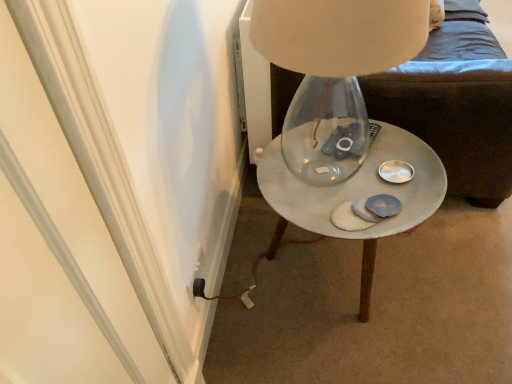
Measure the distance between point (198, 277) and camera.

They are 1.21 meters apart.

Locate an element on the screen. The height and width of the screenshot is (384, 512). black plastic outlet at lower left is located at coordinates (198, 275).

In terms of height, does white marble side table at center look taller or shorter compared to black plastic outlet at lower left?

In the image, white marble side table at center appears to be taller than black plastic outlet at lower left.

What's the angular difference between white marble side table at center and black plastic outlet at lower left's facing directions?

The angle between the facing direction of white marble side table at center and the facing direction of black plastic outlet at lower left is 1.28 degrees.

Looking at this image, considering the sizes of objects white marble side table at center and black plastic outlet at lower left in the image provided, who is thinner, white marble side table at center or black plastic outlet at lower left?

black plastic outlet at lower left.

From a real-world perspective, who is located higher, white marble side table at center or black plastic outlet at lower left?

From a 3D spatial view, black plastic outlet at lower left is above.

Which of these two, black plastic outlet at lower left or white marble side table at center, is wider?

white marble side table at center is wider.

Who is bigger, black plastic outlet at lower left or white marble side table at center?

white marble side table at center.

Does black plastic outlet at lower left turn towards white marble side table at center?

No.

From their relative heights in the image, would you say white marble side table at center is taller or shorter than black plastic outlet at lower left?

white marble side table at center is taller than black plastic outlet at lower left.

Locate an element on the screen. The width and height of the screenshot is (512, 384). furniture that appears above the black plastic outlet at lower left (from the image's perspective) is located at coordinates (453, 123).

How much distance is there between white marble side table at center and black plastic outlet at lower left?

A distance of 37.79 inches exists between white marble side table at center and black plastic outlet at lower left.

Is white marble side table at center directly adjacent to white marble side table at center?

white marble side table at center is not next to white marble side table at center, and they're not touching.

Is point (365, 97) farther from camera compared to point (304, 190)?

Yes, point (365, 97) is behind point (304, 190).

Locate an element on the screen. This screenshot has height=384, width=512. table located underneath the white marble side table at center (from a real-world perspective) is located at coordinates (356, 196).

Is white marble side table at center shorter than white marble side table at center?

Incorrect, the height of white marble side table at center does not fall short of that of white marble side table at center.

Does black plastic outlet at lower left have a greater width compared to white marble side table at center?

No, black plastic outlet at lower left is not wider than white marble side table at center.

Does point (193, 270) come in front of point (278, 222)?

Yes, it is in front of point (278, 222).

Considering the relative sizes of black plastic outlet at lower left and white marble side table at center in the image provided, is black plastic outlet at lower left smaller than white marble side table at center?

Yes, black plastic outlet at lower left is smaller than white marble side table at center.

From a real-world perspective, is black plastic outlet at lower left over white marble side table at center?

Indeed, from a real-world perspective, black plastic outlet at lower left stands above white marble side table at center.

From a real-world perspective, which object stands above the other?

white marble side table at center, from a real-world perspective.

There is a white marble side table at center. At what (x,y) coordinates should I click in order to perform the action: click on furniture above it (from a real-world perspective). Please return your answer as a coordinate pair (x, y). Looking at the image, I should click on (453, 123).

Looking at the image, does white marble side table at center seem bigger or smaller compared to white marble side table at center?

Considering their sizes, white marble side table at center takes up more space than white marble side table at center.

Considering the relative sizes of white marble side table at center and white marble side table at center in the image provided, is white marble side table at center thinner than white marble side table at center?

In fact, white marble side table at center might be wider than white marble side table at center.

At what (x,y) coordinates should I click in order to perform the action: click on electric outlet located behind the white marble side table at center. Please return your answer as a coordinate pair (x, y). Looking at the image, I should click on (198, 275).

Identify the location of electric outlet on the left of white marble side table at center. (198, 275).

Considering their positions, is white marble side table at center positioned closer to white marble side table at center than black plastic outlet at lower left?

The object closer to white marble side table at center is white marble side table at center.

Based on their spatial positions, is black plastic outlet at lower left or white marble side table at center closer to white marble side table at center?

white marble side table at center is closer to white marble side table at center.

Estimate the real-world distances between objects in this image. Which object is closer to black plastic outlet at lower left, white marble side table at center or white marble side table at center?

white marble side table at center is positioned closer to the anchor black plastic outlet at lower left.

Based on the photo, looking at the image, which one is located further to white marble side table at center, black plastic outlet at lower left or white marble side table at center?

black plastic outlet at lower left is positioned further to the anchor white marble side table at center.

From the image, which object appears to be farther from white marble side table at center, white marble side table at center or black plastic outlet at lower left?

black plastic outlet at lower left is further to white marble side table at center.

Based on the photo, considering their positions, is white marble side table at center positioned closer to black plastic outlet at lower left than white marble side table at center?

white marble side table at center lies closer to black plastic outlet at lower left than the other object.

At what (x,y) coordinates should I click in order to perform the action: click on table between white marble side table at center and black plastic outlet at lower left in the up-down direction. Please return your answer as a coordinate pair (x, y). The height and width of the screenshot is (384, 512). Looking at the image, I should click on (356, 196).